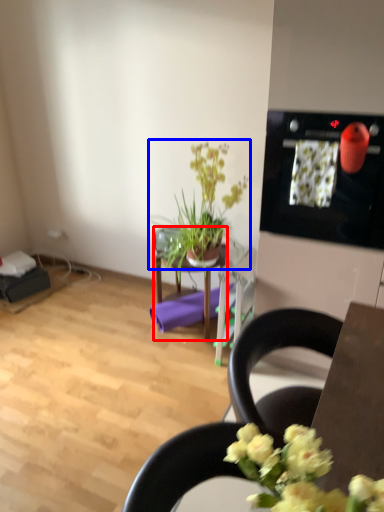
Question: Among these objects, which one is nearest to the camera, table (highlighted by a red box) or houseplant (highlighted by a blue box)?

Choices:
 (A) table
 (B) houseplant

Answer: (B)